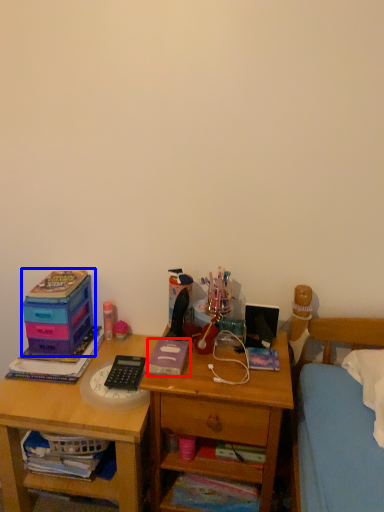
Question: Which point is closer to the camera, book (highlighted by a red box) or storage box (highlighted by a blue box)?

Choices:
 (A) book
 (B) storage box

Answer: (A)